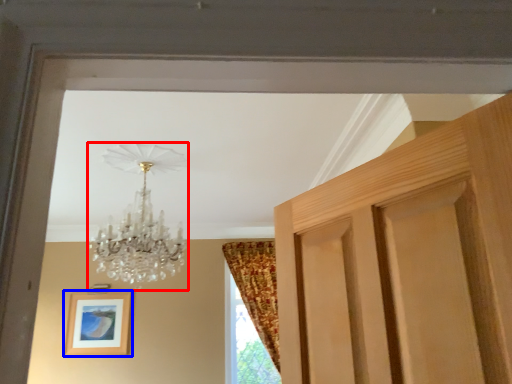
Question: Which object appears closest to the camera in this image, lamp (highlighted by a red box) or picture frame (highlighted by a blue box)?

Choices:
 (A) lamp
 (B) picture frame

Answer: (A)